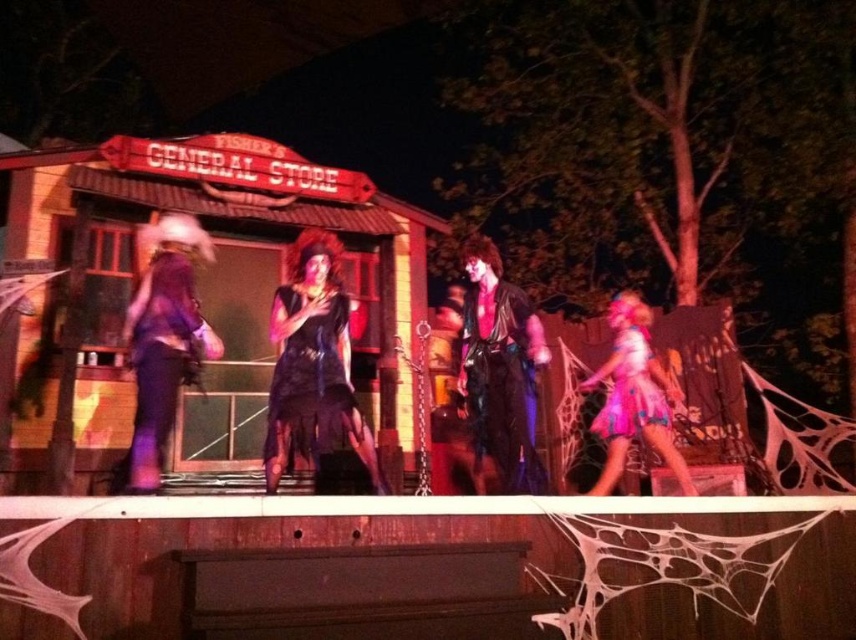
Question: Which of the following is the closest to the observer?

Choices:
 (A) pink satin dress at lower right
 (B) black velvet dress at center
 (C) purple velvet dress at left
 (D) leather-like black dress at center

Answer: (C)

Question: Does black velvet dress at center have a greater width compared to pink satin dress at lower right?

Choices:
 (A) yes
 (B) no

Answer: (B)

Question: Which object is positioned closest to the pink satin dress at lower right?

Choices:
 (A) black velvet dress at center
 (B) purple velvet dress at left
 (C) leather-like black dress at center

Answer: (C)

Question: Can you confirm if purple velvet dress at left is positioned to the right of pink satin dress at lower right?

Choices:
 (A) no
 (B) yes

Answer: (A)

Question: Which point is closer to the camera?

Choices:
 (A) (462, 369)
 (B) (336, 284)

Answer: (B)

Question: Is black velvet dress at center smaller than purple velvet dress at left?

Choices:
 (A) yes
 (B) no

Answer: (A)